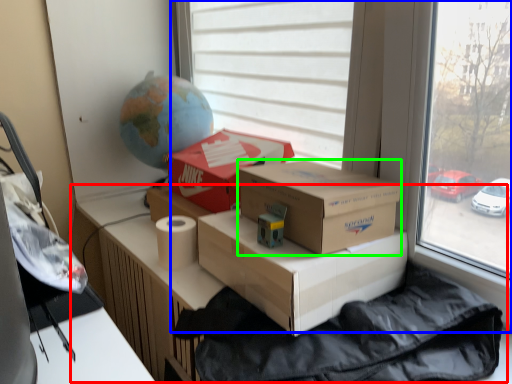
Question: Which is nearer to the table (highlighted by a red box)? window (highlighted by a blue box) or box (highlighted by a green box).

Choices:
 (A) window
 (B) box

Answer: (B)